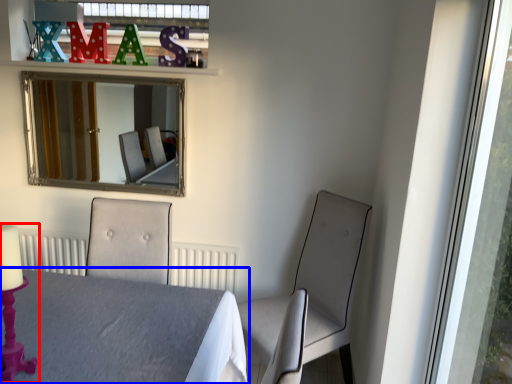
Question: Which object appears farthest to the camera in this image, candle holder (highlighted by a red box) or table (highlighted by a blue box)?

Choices:
 (A) candle holder
 (B) table

Answer: (A)